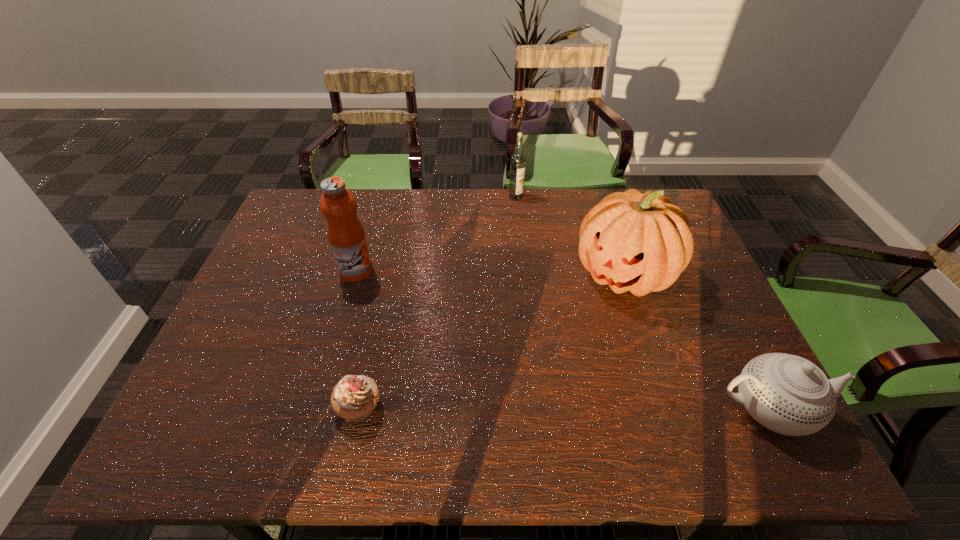
Locate an element on the screen. vacant point located between the shortest object and the pumpkin is located at coordinates (492, 341).

Identify the location of vacant area that lies between the chinaware and the fruit juice. (562, 340).

Where is `vacant region between the cupcake and the pumpkin`? vacant region between the cupcake and the pumpkin is located at coordinates (492, 341).

Find the location of a particular element. The width and height of the screenshot is (960, 540). unoccupied area between the farthest object and the fourth tallest object is located at coordinates (641, 303).

I want to click on free space between the fruit juice and the third tallest object, so click(436, 234).

Locate an element on the screen. The width and height of the screenshot is (960, 540). object that is the second closest one to the fruit juice is located at coordinates pyautogui.click(x=518, y=160).

Identify which object is the second closest to the shortest object. Please provide its 2D coordinates. Your answer should be formatted as a tuple, i.e. [(x, y)], where the tuple contains the x and y coordinates of a point satisfying the conditions above.

[(639, 242)]

Identify the location of free point that satisfies the following two spatial constraints: 1. on the front side of the fourth tallest object; 2. on the spout of the pumpkin. This screenshot has height=540, width=960. (668, 409).

The image size is (960, 540). In order to click on vacant position in the image that satisfies the following two spatial constraints: 1. on the back side of the fruit juice; 2. on the right side of the vodka in this screenshot , I will do coord(377,197).

Locate an element on the screen. This screenshot has height=540, width=960. vacant space that satisfies the following two spatial constraints: 1. on the front side of the second shortest object; 2. on the spout of the fruit juice is located at coordinates (318, 409).